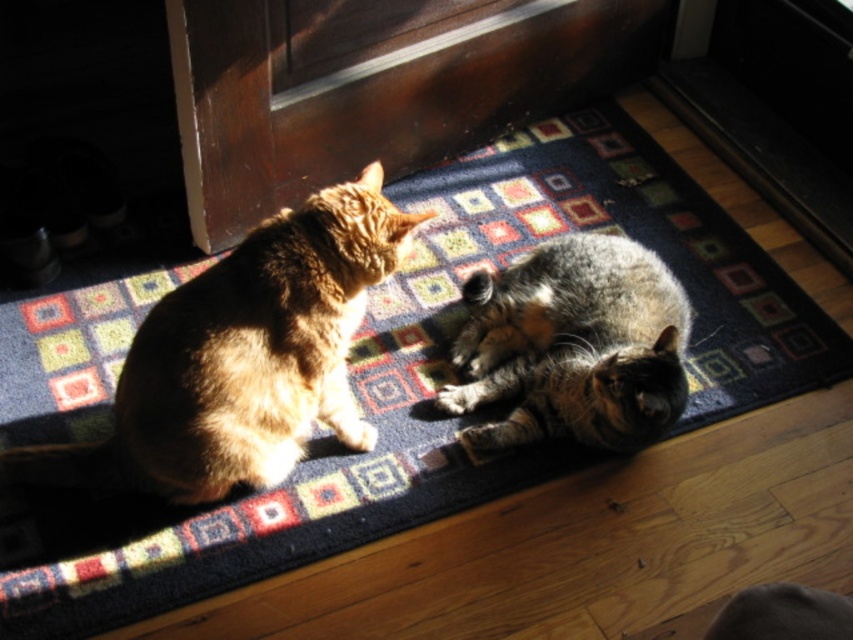
From the picture: Can you confirm if tabby fur cat at left is wider than tabby fur cat at lower center?

Indeed, tabby fur cat at left has a greater width compared to tabby fur cat at lower center.

How far apart are tabby fur cat at left and tabby fur cat at lower center?

A distance of 19.41 inches exists between tabby fur cat at left and tabby fur cat at lower center.

Which is in front, point (241, 304) or point (612, 365)?

Point (241, 304) is in front.

In order to click on tabby fur cat at left in this screenshot , I will do `click(242, 356)`.

Is wooden screen door at upper center above tabby fur cat at left?

Yes.

Between point (409, 161) and point (306, 305), which one is positioned behind?

Point (409, 161)

Identify the location of wooden screen door at upper center. (370, 86).

Which is more to the left, wooden screen door at upper center or tabby fur cat at lower center?

wooden screen door at upper center is more to the left.

Does wooden screen door at upper center have a lesser height compared to tabby fur cat at lower center?

No.

Is point (318, 104) in front of point (553, 243)?

No, (318, 104) is behind (553, 243).

In order to click on wooden screen door at upper center in this screenshot , I will do click(370, 86).